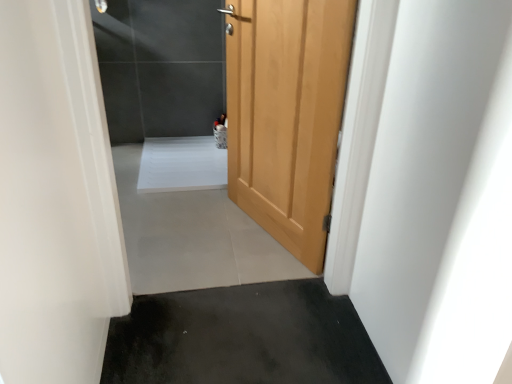
Question: In which direction should I rotate to look at black rubber mat at lower center, the 1th concrete positioned from the bottom?

Choices:
 (A) right
 (B) left

Answer: (B)

Question: Does wooden door at center have a lesser height compared to wooden door at center?

Choices:
 (A) yes
 (B) no

Answer: (A)

Question: Does wooden door at center turn towards wooden door at center?

Choices:
 (A) no
 (B) yes

Answer: (B)

Question: Can you confirm if wooden door at center is wider than wooden door at center?

Choices:
 (A) no
 (B) yes

Answer: (A)

Question: Is there a large distance between wooden door at center and wooden door at center?

Choices:
 (A) yes
 (B) no

Answer: (A)

Question: Is the position of wooden door at center more distant than that of wooden door at center?

Choices:
 (A) no
 (B) yes

Answer: (B)

Question: Is wooden door at center in contact with wooden door at center?

Choices:
 (A) no
 (B) yes

Answer: (A)

Question: Does gray tile floor at center, which appears as the 2th concrete when ordered from the bottom, have a larger size compared to wooden door at center?

Choices:
 (A) no
 (B) yes

Answer: (A)

Question: Considering the relative positions of gray tile floor at center, arranged as the second concrete when viewed from the front, and wooden door at center in the image provided, is gray tile floor at center, arranged as the second concrete when viewed from the front, behind wooden door at center?

Choices:
 (A) no
 (B) yes

Answer: (B)

Question: From the image's perspective, is gray tile floor at center, which is the 1th concrete from top to bottom, below wooden door at center?

Choices:
 (A) no
 (B) yes

Answer: (B)

Question: Does gray tile floor at center, which appears as the 2th concrete when ordered from the bottom, have a smaller size compared to wooden door at center?

Choices:
 (A) yes
 (B) no

Answer: (A)

Question: Can you confirm if gray tile floor at center, the 1th concrete when ordered from back to front, is shorter than wooden door at center?

Choices:
 (A) no
 (B) yes

Answer: (B)

Question: Is the depth of gray tile floor at center, arranged as the second concrete when viewed from the front, less than that of wooden door at center?

Choices:
 (A) no
 (B) yes

Answer: (A)

Question: From the image's perspective, is black rubber mat at lower center, acting as the second concrete starting from the top, below wooden door at center?

Choices:
 (A) yes
 (B) no

Answer: (A)